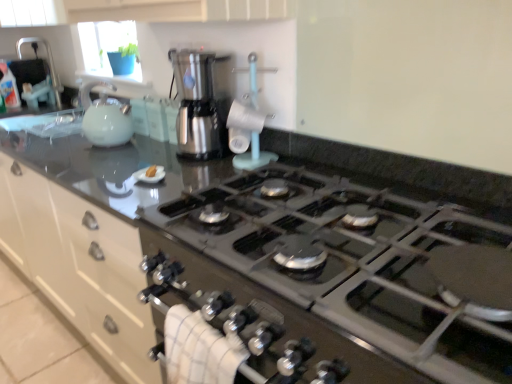
Question: Does matte white kettle at left, the first kitchen appliance when ordered from left to right, appear on the right side of stainless steel coffee maker at center, which ranks as the 1th kitchen appliance in right-to-left order?

Choices:
 (A) no
 (B) yes

Answer: (A)

Question: From the image's perspective, does matte white kettle at left, the 2th kitchen appliance from the right, appear lower than stainless steel coffee maker at center, arranged as the second kitchen appliance when viewed from the left?

Choices:
 (A) yes
 (B) no

Answer: (B)

Question: Is the depth of matte white kettle at left, the first kitchen appliance when ordered from left to right, greater than that of stainless steel coffee maker at center, arranged as the second kitchen appliance when viewed from the left?

Choices:
 (A) no
 (B) yes

Answer: (B)

Question: Considering the relative sizes of matte white kettle at left, the 2th kitchen appliance from the right, and stainless steel coffee maker at center, arranged as the second kitchen appliance when viewed from the left, in the image provided, is matte white kettle at left, the 2th kitchen appliance from the right, thinner than stainless steel coffee maker at center, arranged as the second kitchen appliance when viewed from the left,?

Choices:
 (A) yes
 (B) no

Answer: (B)

Question: Does matte white kettle at left, the first kitchen appliance when ordered from left to right, have a greater height compared to stainless steel coffee maker at center, which ranks as the 1th kitchen appliance in right-to-left order?

Choices:
 (A) no
 (B) yes

Answer: (A)

Question: Considering the relative sizes of matte white kettle at left, the first kitchen appliance when ordered from left to right, and stainless steel coffee maker at center, which ranks as the 1th kitchen appliance in right-to-left order, in the image provided, is matte white kettle at left, the first kitchen appliance when ordered from left to right, wider than stainless steel coffee maker at center, which ranks as the 1th kitchen appliance in right-to-left order,?

Choices:
 (A) no
 (B) yes

Answer: (B)

Question: Is brushed metal sink at upper left shorter than black glass stove at center?

Choices:
 (A) yes
 (B) no

Answer: (B)

Question: Are brushed metal sink at upper left and black glass stove at center making contact?

Choices:
 (A) yes
 (B) no

Answer: (B)

Question: From a real-world perspective, is brushed metal sink at upper left positioned over black glass stove at center based on gravity?

Choices:
 (A) no
 (B) yes

Answer: (B)

Question: From the image's perspective, would you say brushed metal sink at upper left is positioned over black glass stove at center?

Choices:
 (A) no
 (B) yes

Answer: (B)

Question: From a real-world perspective, is brushed metal sink at upper left physically below black glass stove at center?

Choices:
 (A) yes
 (B) no

Answer: (B)

Question: Is brushed metal sink at upper left surrounding black glass stove at center?

Choices:
 (A) no
 (B) yes

Answer: (A)

Question: Are yellow sponge at center and black glass stove at center located far from each other?

Choices:
 (A) no
 (B) yes

Answer: (A)